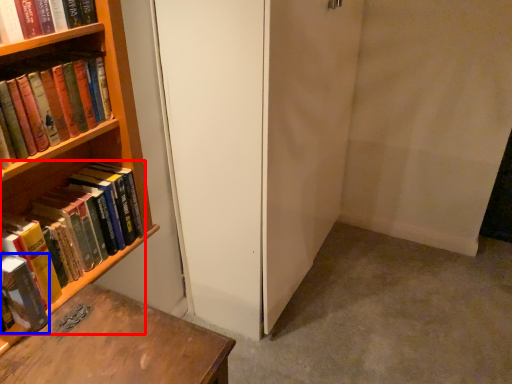
Question: Among these objects, which one is farthest to the camera, book (highlighted by a red box) or book (highlighted by a blue box)?

Choices:
 (A) book
 (B) book

Answer: (A)